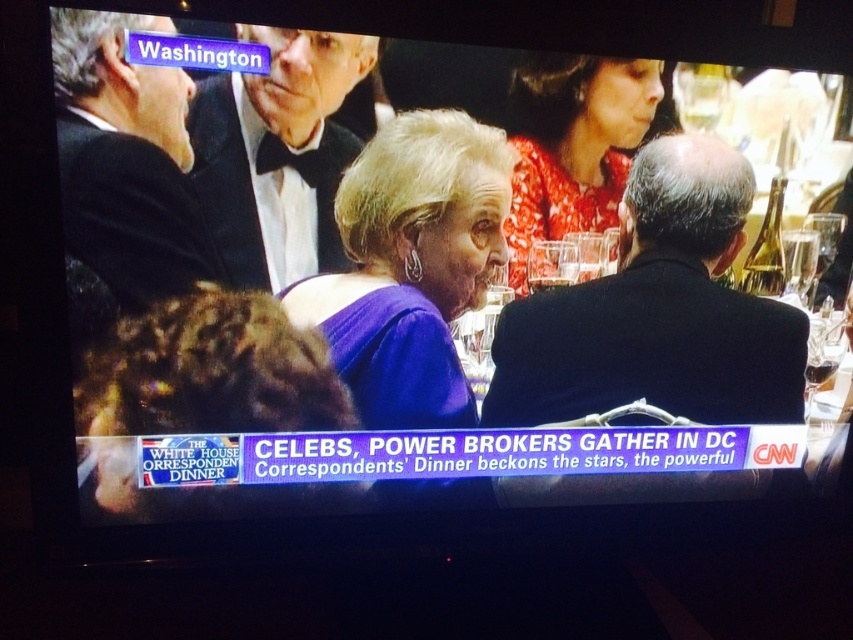
You are a photographer at the event and need to capture both the purple satin dress at center and the black tuxedo at upper center in a single frame. Which outfit should you focus on first to ensure it fits properly in the photo?

The purple satin dress at center has a larger size compared to the black tuxedo at upper center. Therefore, you should focus on the purple satin dress at center first to ensure its larger size is properly framed before adjusting for the smaller black tuxedo at upper center.